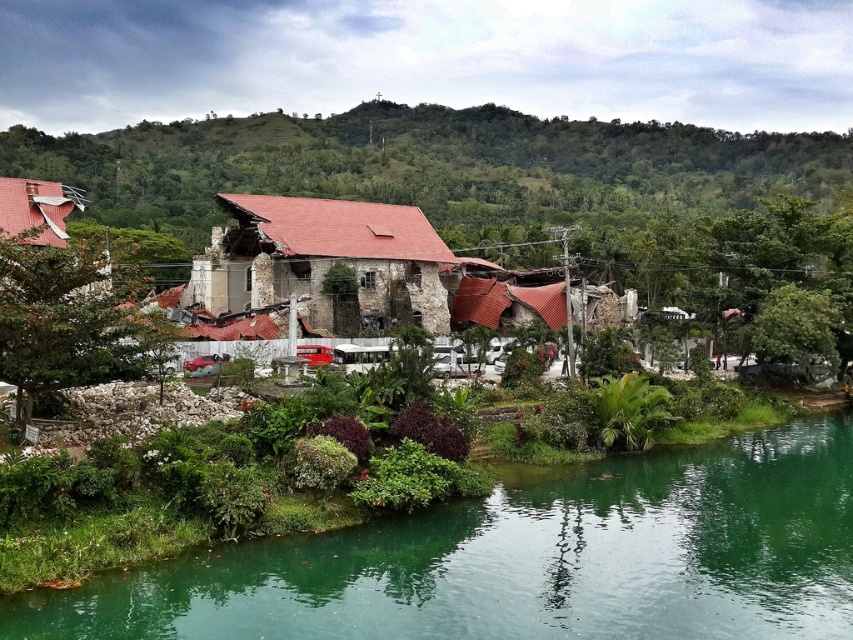
Question: Which object appears closest to the camera in this image?

Choices:
 (A) green smooth water at lower center
 (B) rusty metal hut at center
 (C) green leafy hillside at upper center

Answer: (A)

Question: Does green smooth water at lower center have a smaller size compared to rusty metal hut at center?

Choices:
 (A) no
 (B) yes

Answer: (B)

Question: Which object is the farthest from the green smooth water at lower center?

Choices:
 (A) green leafy hillside at upper center
 (B) rusty metal hut at center

Answer: (A)

Question: Which object is farther from the camera taking this photo?

Choices:
 (A) green leafy hillside at upper center
 (B) green smooth water at lower center

Answer: (A)

Question: Does green smooth water at lower center appear under rusty metal hut at center?

Choices:
 (A) yes
 (B) no

Answer: (A)

Question: Is green smooth water at lower center positioned at the back of green leafy hillside at upper center?

Choices:
 (A) yes
 (B) no

Answer: (B)